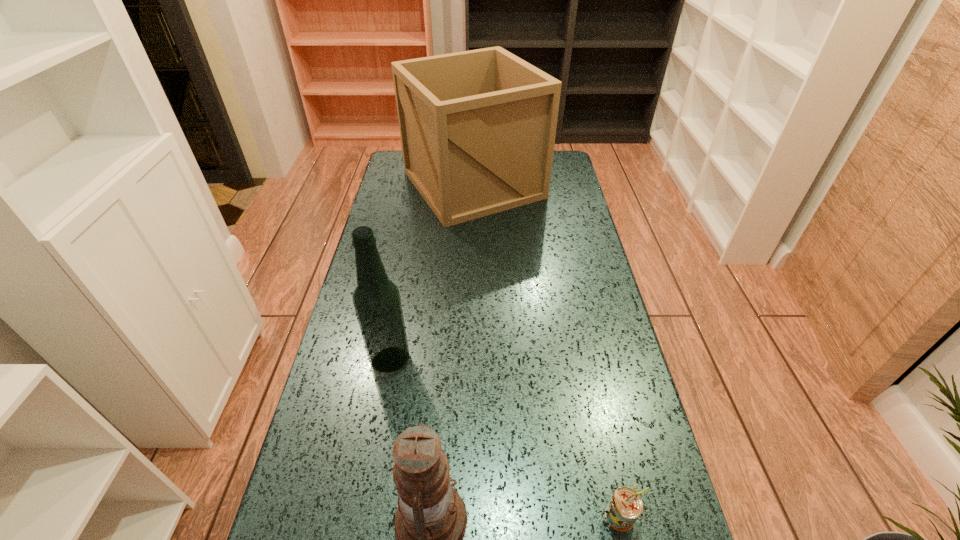
The image size is (960, 540). Identify the location of can present at the right edge. (625, 506).

At what (x,y) coordinates should I click in order to perform the action: click on object situated at the far left corner. Please return your answer as a coordinate pair (x, y). This screenshot has width=960, height=540. Looking at the image, I should click on (477, 128).

Locate an element on the screen. The width and height of the screenshot is (960, 540). object that is at the far right corner is located at coordinates (477, 128).

The width and height of the screenshot is (960, 540). Find the location of `vacant point at the left edge`. vacant point at the left edge is located at coordinates (381, 220).

You are a GUI agent. You are given a task and a screenshot of the screen. Output one action in this format:
    pyautogui.click(x=<x>, y=<y>)
    Task: Click on the vacant space at the right edge of the desktop
    This screenshot has width=960, height=540.
    Given the screenshot: What is the action you would take?
    pyautogui.click(x=540, y=202)

You are a GUI agent. You are given a task and a screenshot of the screen. Output one action in this format:
    pyautogui.click(x=<x>, y=<y>)
    Task: Click on the vacant space at the far right corner
    
    Given the screenshot: What is the action you would take?
    pyautogui.click(x=558, y=178)

The width and height of the screenshot is (960, 540). In order to click on empty space that is in between the alcohol and the can in this screenshot , I will do `click(505, 436)`.

Find the location of `vacant space in between the box and the third nearest object`. vacant space in between the box and the third nearest object is located at coordinates (432, 272).

The width and height of the screenshot is (960, 540). In order to click on free spot between the box and the second farthest object in this screenshot , I will do `click(432, 272)`.

The image size is (960, 540). I want to click on free space between the can and the box, so click(x=547, y=349).